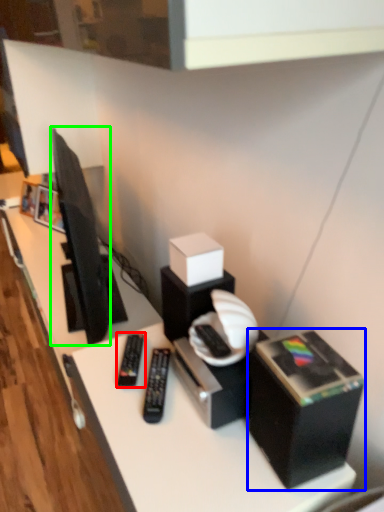
Question: Which object is positioned closest to equipment (highlighted by a red box)? Select from box (highlighted by a blue box) and television (highlighted by a green box).

Choices:
 (A) box
 (B) television

Answer: (A)